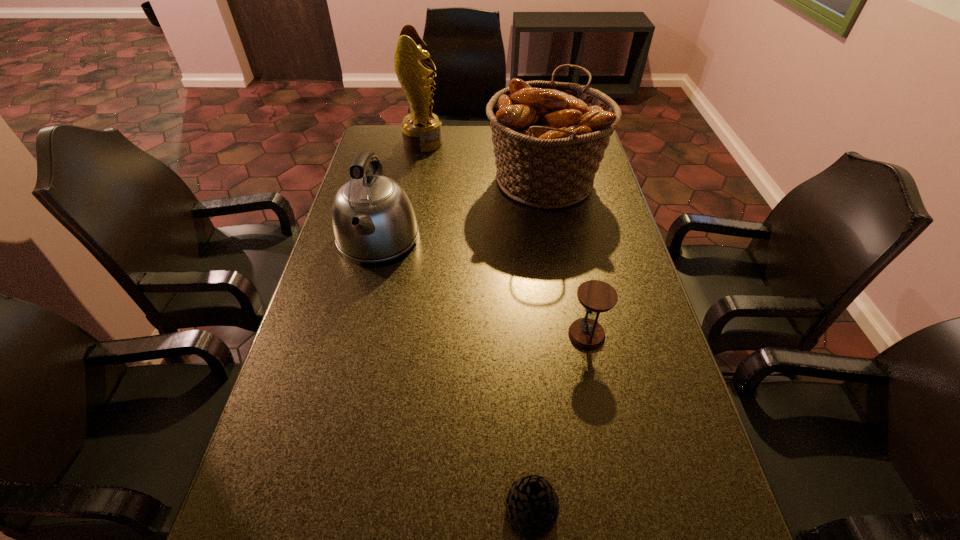
The width and height of the screenshot is (960, 540). In order to click on object that is at the far left corner in this screenshot , I will do `click(421, 129)`.

Where is `object that is at the far right corner`? The width and height of the screenshot is (960, 540). object that is at the far right corner is located at coordinates (549, 138).

The width and height of the screenshot is (960, 540). I want to click on blank area at the far edge, so click(x=472, y=138).

Locate an element on the screen. vacant position at the left edge of the desktop is located at coordinates (343, 326).

Locate an element on the screen. This screenshot has width=960, height=540. vacant point at the right edge is located at coordinates (573, 211).

Where is `blank region between the tallest object and the fourth farthest object`? blank region between the tallest object and the fourth farthest object is located at coordinates (505, 238).

Where is `free space between the award and the second nearest object`? free space between the award and the second nearest object is located at coordinates (505, 238).

At what (x,y) coordinates should I click in order to perform the action: click on vacant region between the third tallest object and the fourth tallest object. Please return your answer as a coordinate pair (x, y). Image resolution: width=960 pixels, height=540 pixels. Looking at the image, I should click on (482, 287).

Find the location of `blank region between the fourth farthest object and the shortest object`. blank region between the fourth farthest object and the shortest object is located at coordinates (559, 422).

You are a GUI agent. You are given a task and a screenshot of the screen. Output one action in this format:
    pyautogui.click(x=<x>, y=<y>)
    Task: Click on the object identified as the fourth closest to the third shortest object
    The image size is (960, 540).
    Given the screenshot: What is the action you would take?
    pyautogui.click(x=532, y=504)